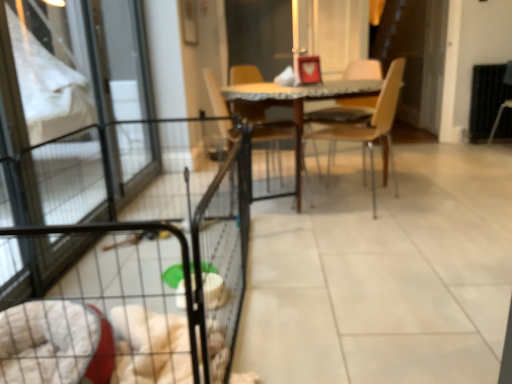
Describe the element at coordinates (74, 111) in the screenshot. The height and width of the screenshot is (384, 512). I see `clear glass screen door at left` at that location.

This screenshot has height=384, width=512. What do you see at coordinates (300, 94) in the screenshot?
I see `wooden table at center` at bounding box center [300, 94].

Find the location of a particular element. This screenshot has width=512, height=384. black wire cage at lower left is located at coordinates (134, 294).

The width and height of the screenshot is (512, 384). What do you see at coordinates (134, 294) in the screenshot? I see `black wire cage at lower left` at bounding box center [134, 294].

Find the location of a particular element. dark brown leather armchair at right is located at coordinates (500, 117).

Describe the element at coordinates (500, 117) in the screenshot. I see `dark brown leather armchair at right` at that location.

Where is `clear glass screen door at left`? clear glass screen door at left is located at coordinates 74,111.

Is wooden table at center taller or shorter than dark brown leather armchair at right?

Clearly, wooden table at center is shorter compared to dark brown leather armchair at right.

Based on the photo, can you confirm if wooden table at center is bigger than dark brown leather armchair at right?

Indeed, wooden table at center has a larger size compared to dark brown leather armchair at right.

Considering the relative sizes of wooden table at center and dark brown leather armchair at right in the image provided, is wooden table at center thinner than dark brown leather armchair at right?

Incorrect, the width of wooden table at center is not less than that of dark brown leather armchair at right.

From the image's perspective, who appears lower, wooden chair at center, the 2th chair in the right-to-left sequence, or black wire cage at lower left?

From the image's view, black wire cage at lower left is below.

Is wooden chair at center, the 2th chair in the right-to-left sequence, touching black wire cage at lower left?

No, wooden chair at center, the 2th chair in the right-to-left sequence, is not next to black wire cage at lower left.

Which object is wider, wooden chair at center, the 2th chair in the right-to-left sequence, or black wire cage at lower left?

Wider between the two is black wire cage at lower left.

Considering the positions of point (297, 95) and point (74, 336), is point (297, 95) closer or farther from the camera than point (74, 336)?

Point (297, 95) is positioned farther from the camera compared to point (74, 336).

The image size is (512, 384). What are the coordinates of `table that appears on the right of black wire cage at lower left` in the screenshot? It's located at (300, 94).

Considering the sizes of wooden table at center and black wire cage at lower left in the image, is wooden table at center taller or shorter than black wire cage at lower left?

Clearly, wooden table at center is taller compared to black wire cage at lower left.

Is dark brown leather armchair at right further to camera compared to wooden chair at center, which appears as the 2th chair when viewed from the left?

Yes, dark brown leather armchair at right is further from the camera.

Considering the sizes of objects dark brown leather armchair at right and wooden chair at center, the first chair from the right, in the image provided, who is thinner, dark brown leather armchair at right or wooden chair at center, the first chair from the right,?

With smaller width is dark brown leather armchair at right.

Based on their sizes in the image, would you say dark brown leather armchair at right is bigger or smaller than wooden chair at center, which appears as the 2th chair when viewed from the left?

Considering their sizes, dark brown leather armchair at right takes up less space than wooden chair at center, which appears as the 2th chair when viewed from the left.

Which object is further away from the camera taking this photo, clear glass screen door at left or wooden table at center?

wooden table at center.

Is clear glass screen door at left wider or thinner than wooden table at center?

Clearly, clear glass screen door at left has less width compared to wooden table at center.

Is clear glass screen door at left taller than wooden table at center?

Yes.

From the image's perspective, which one is positioned lower, clear glass screen door at left or wooden table at center?

wooden table at center, from the image's perspective.

Could you tell me if clear glass screen door at left is turned towards wooden chair at center, which is counted as the 1th chair, starting from the left?

Yes, clear glass screen door at left is aimed at wooden chair at center, which is counted as the 1th chair, starting from the left.

Considering the sizes of clear glass screen door at left and wooden chair at center, which is counted as the 1th chair, starting from the left, in the image, is clear glass screen door at left wider or thinner than wooden chair at center, which is counted as the 1th chair, starting from the left,?

In the image, clear glass screen door at left appears to be more narrow than wooden chair at center, which is counted as the 1th chair, starting from the left.

Is clear glass screen door at left inside the boundaries of wooden chair at center, the 2th chair in the right-to-left sequence, or outside?

clear glass screen door at left is spatially situated outside wooden chair at center, the 2th chair in the right-to-left sequence.

Which is behind, point (0, 119) or point (300, 145)?

The point (300, 145) is behind.

Can you tell me how much wooden chair at center, the 2th chair in the right-to-left sequence, and wooden table at center differ in facing direction?

The facing directions of wooden chair at center, the 2th chair in the right-to-left sequence, and wooden table at center are 21.8 degrees apart.

Considering the relative sizes of wooden chair at center, which is counted as the 1th chair, starting from the left, and wooden table at center in the image provided, is wooden chair at center, which is counted as the 1th chair, starting from the left, bigger than wooden table at center?

No, wooden chair at center, which is counted as the 1th chair, starting from the left, is not bigger than wooden table at center.

Considering the relative positions of wooden chair at center, the 2th chair in the right-to-left sequence, and wooden table at center in the image provided, is wooden chair at center, the 2th chair in the right-to-left sequence, to the left of wooden table at center from the viewer's perspective?

Indeed, wooden chair at center, the 2th chair in the right-to-left sequence, is positioned on the left side of wooden table at center.

Is wooden chair at center, which is counted as the 1th chair, starting from the left, oriented towards wooden table at center?

Yes, wooden chair at center, which is counted as the 1th chair, starting from the left, is aimed at wooden table at center.

You are a GUI agent. You are given a task and a screenshot of the screen. Output one action in this format:
    pyautogui.click(x=<x>, y=<y>)
    Task: Click on the armchair below the wooden table at center (from a real-world perspective)
    The height and width of the screenshot is (384, 512).
    Given the screenshot: What is the action you would take?
    pyautogui.click(x=500, y=117)

Where is `cage on the left side of wooden chair at center, the 2th chair in the right-to-left sequence`? The width and height of the screenshot is (512, 384). cage on the left side of wooden chair at center, the 2th chair in the right-to-left sequence is located at coordinates (134, 294).

From the image, which object appears to be farther from clear glass screen door at left, wooden chair at center, the first chair from the right, or wooden chair at center, the 2th chair in the right-to-left sequence?

wooden chair at center, the first chair from the right, is positioned further to the anchor clear glass screen door at left.

Estimate the real-world distances between objects in this image. Which object is further from black wire cage at lower left, clear glass screen door at left or wooden chair at center, the first chair from the right?

The object further to black wire cage at lower left is wooden chair at center, the first chair from the right.

When comparing their distances from wooden chair at center, which appears as the 2th chair when viewed from the left, does wooden chair at center, the 2th chair in the right-to-left sequence, or wooden table at center seem further?

wooden chair at center, the 2th chair in the right-to-left sequence.

Based on their spatial positions, is wooden chair at center, which appears as the 2th chair when viewed from the left, or dark brown leather armchair at right closer to wooden table at center?

The object closer to wooden table at center is wooden chair at center, which appears as the 2th chair when viewed from the left.

When comparing their distances from wooden chair at center, the 2th chair in the right-to-left sequence, does wooden table at center or wooden chair at center, the first chair from the right, seem further?

The object further to wooden chair at center, the 2th chair in the right-to-left sequence, is wooden chair at center, the first chair from the right.

Estimate the real-world distances between objects in this image. Which object is closer to wooden chair at center, the first chair from the right, wooden table at center or clear glass screen door at left?

Based on the image, wooden table at center appears to be nearer to wooden chair at center, the first chair from the right.

Estimate the real-world distances between objects in this image. Which object is closer to dark brown leather armchair at right, wooden chair at center, the first chair from the right, or black wire cage at lower left?

The object closer to dark brown leather armchair at right is wooden chair at center, the first chair from the right.

Estimate the real-world distances between objects in this image. Which object is closer to black wire cage at lower left, dark brown leather armchair at right or wooden chair at center, which is counted as the 1th chair, starting from the left?

wooden chair at center, which is counted as the 1th chair, starting from the left, is closer to black wire cage at lower left.

Where is `chair between wooden chair at center, the 2th chair in the right-to-left sequence, and dark brown leather armchair at right`? The width and height of the screenshot is (512, 384). chair between wooden chair at center, the 2th chair in the right-to-left sequence, and dark brown leather armchair at right is located at coordinates (370, 130).

At what (x,y) coordinates should I click in order to perform the action: click on chair located between clear glass screen door at left and wooden chair at center, the first chair from the right, in the left-right direction. Please return your answer as a coordinate pair (x, y). The height and width of the screenshot is (384, 512). Looking at the image, I should click on (249, 113).

You are a GUI agent. You are given a task and a screenshot of the screen. Output one action in this format:
    pyautogui.click(x=<x>, y=<y>)
    Task: Click on the screen door between black wire cage at lower left and wooden chair at center, which is counted as the 1th chair, starting from the left, along the z-axis
    The image size is (512, 384).
    Given the screenshot: What is the action you would take?
    pyautogui.click(x=74, y=111)

This screenshot has height=384, width=512. Identify the location of chair positioned between black wire cage at lower left and wooden table at center from near to far. (370, 130).